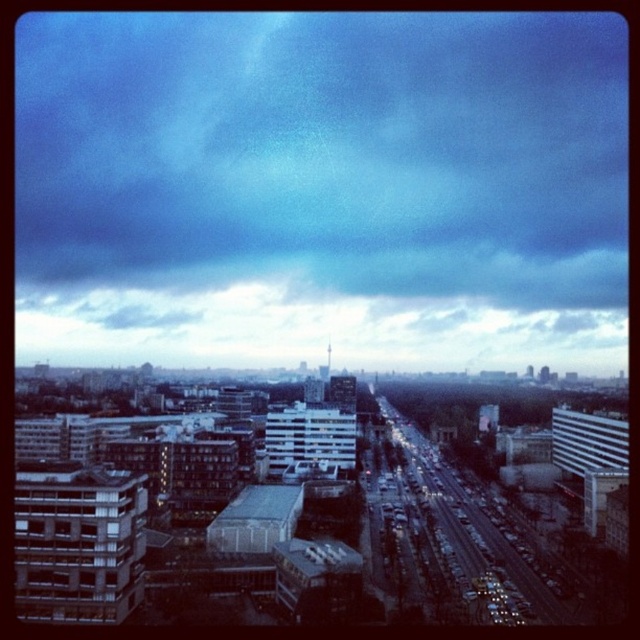
You are standing on the avenue in the image and want to walk towards the two points marked in the scene. Which point, point (611, 269) or point (113, 364), will you reach first?

You will reach point (113, 364) first because it is closer to you than point (611, 269), which is further away.

You are a city planner analyzing traffic patterns. You notice the dark blue cloud at upper center and the cloudy sky at center in the image. Which of these two features is positioned higher in the sky?

The dark blue cloud at upper center is positioned higher in the sky than the cloudy sky at center because it is described as much taller.

You are a city planner analyzing the urban landscape. You notice the dark blue cloud at upper center and the cloudy sky at center. Which of these two elements is located to the left of the other?

The dark blue cloud at upper center is positioned on the left side of cloudy sky at center.